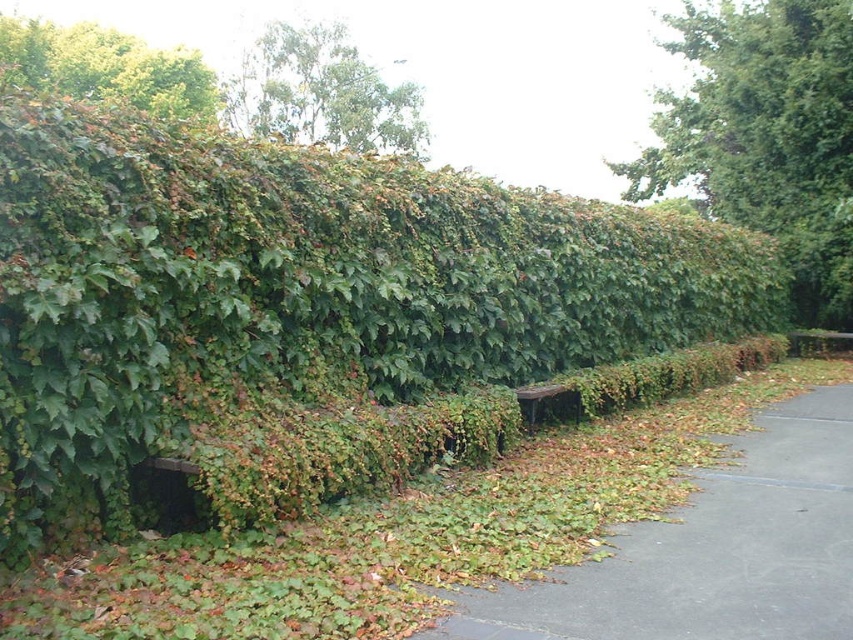
Based on the photo, you are a gardener planning to plant a new flower bed. You need to choose between the gray asphalt pavement at lower right and the green leafy tree at upper left. Which location has more available space for planting?

The green leafy tree at upper left has more available space because the gray asphalt pavement at lower right occupies less space than it.

You are standing on the pathway in front of the hedge and want to place two markers at the exact locations of point (x=419, y=132) and point (x=566, y=388). Which marker will be closer to your current position?

Point (x=419, y=132) is further to the camera than point (x=566, y=388). Since you are standing on the pathway in front of the hedge, the marker at point (x=419, y=132) will be closer to your current position because it is nearer to the camera compared to the other point.